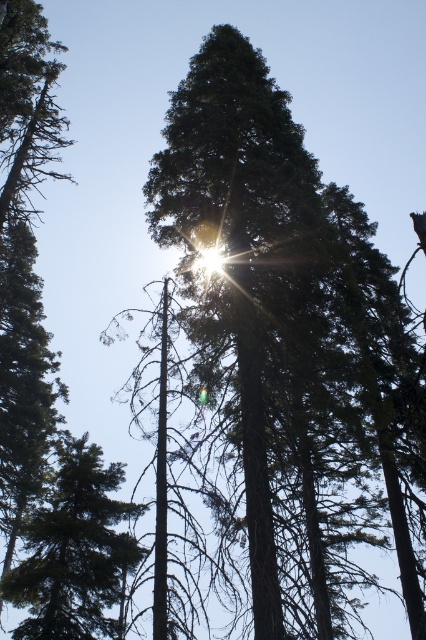
You are standing in the forest and want to locate the green matte tree at lower left. What are its coordinates?

The green matte tree at lower left is located at coordinates point (74, 552).

You are standing in the forest and see the point marked at coordinates (x=74, y=552). What object is located at that point?

The point at coordinates (x=74, y=552) indicates the green matte tree at lower left.

You are a bird flying towards the green matte tree at lower left and the green matte tree at upper left. Which tree is located to the right of the other?

The green matte tree at lower left is positioned on the right side of green matte tree at upper left.